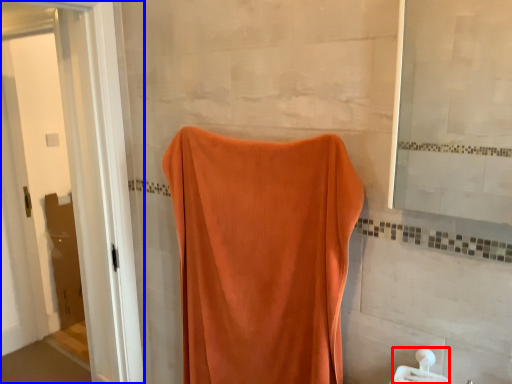
Question: Among these objects, which one is nearest to the camera, towel bar (highlighted by a red box) or screen door (highlighted by a blue box)?

Choices:
 (A) towel bar
 (B) screen door

Answer: (A)